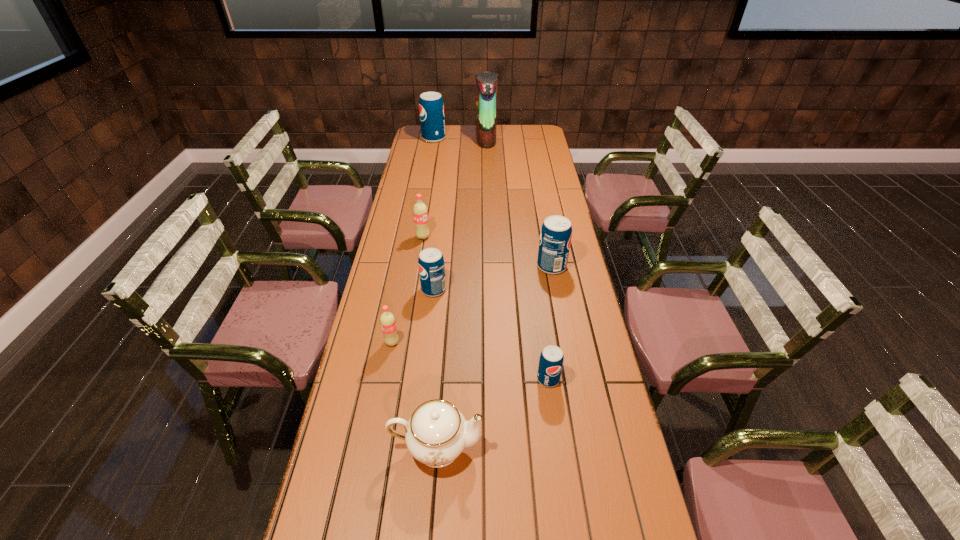
At what (x,y) coordinates should I click in order to perform the action: click on vacant region located on the right of the fourth nearest object. Please return your answer as a coordinate pair (x, y). Looking at the image, I should click on (475, 289).

In order to click on free space located on the left of the nearer red soda in this screenshot , I will do `click(365, 342)`.

Identify the location of vacant region located 0.160m at the spout of the nearest object. This screenshot has width=960, height=540. (545, 446).

Identify the location of free space located 0.350m on the left of the nearest pop. This screenshot has width=960, height=540. (415, 379).

The height and width of the screenshot is (540, 960). Find the location of `parrot located in the far edge section of the desktop`. parrot located in the far edge section of the desktop is located at coordinates (486, 94).

Find the location of a particular element. pop present at the far edge is located at coordinates (431, 107).

Find the location of a particular element. Image resolution: width=960 pixels, height=540 pixels. chinaware that is at the left edge is located at coordinates (436, 434).

In order to click on object at the far left corner in this screenshot , I will do `click(431, 107)`.

Identify the location of free spot at the left edge of the desktop. (375, 330).

Find the location of `vacant space at the right edge`. vacant space at the right edge is located at coordinates (539, 165).